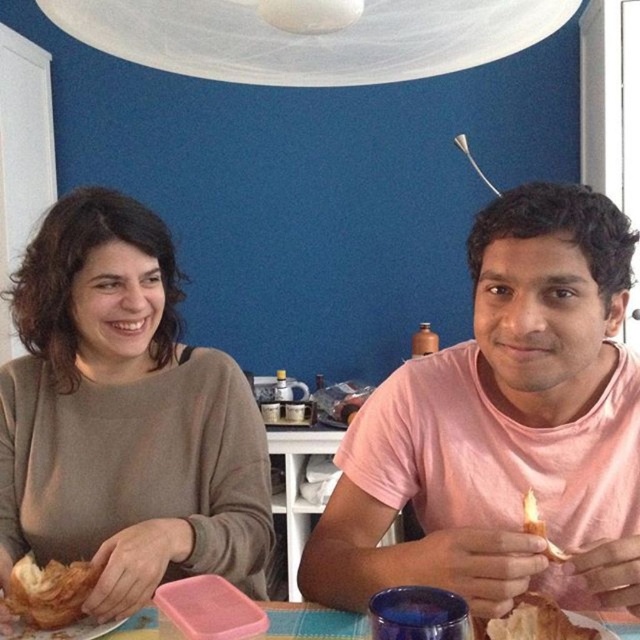
Question: Does golden crispy croissant at lower left lie behind blue woven table at lower center?

Choices:
 (A) yes
 (B) no

Answer: (A)

Question: Is pink matte shirt at right to the right of golden crispy croissant at lower left from the viewer's perspective?

Choices:
 (A) yes
 (B) no

Answer: (A)

Question: Based on their relative distances, which object is nearer to the golden crispy croissant at lower right?

Choices:
 (A) pink matte shirt at right
 (B) golden crispy croissant at lower left

Answer: (A)

Question: Does pink matte shirt at right appear on the left side of golden crispy croissant at lower right?

Choices:
 (A) no
 (B) yes

Answer: (B)

Question: Which object is closer to the camera taking this photo?

Choices:
 (A) blue woven table at lower center
 (B) pink matte shirt at right

Answer: (B)

Question: Which object appears closest to the camera in this image?

Choices:
 (A) pink matte shirt at right
 (B) golden crispy croissant at lower left
 (C) matte brown sweater at left
 (D) golden crispy croissant at lower right

Answer: (A)